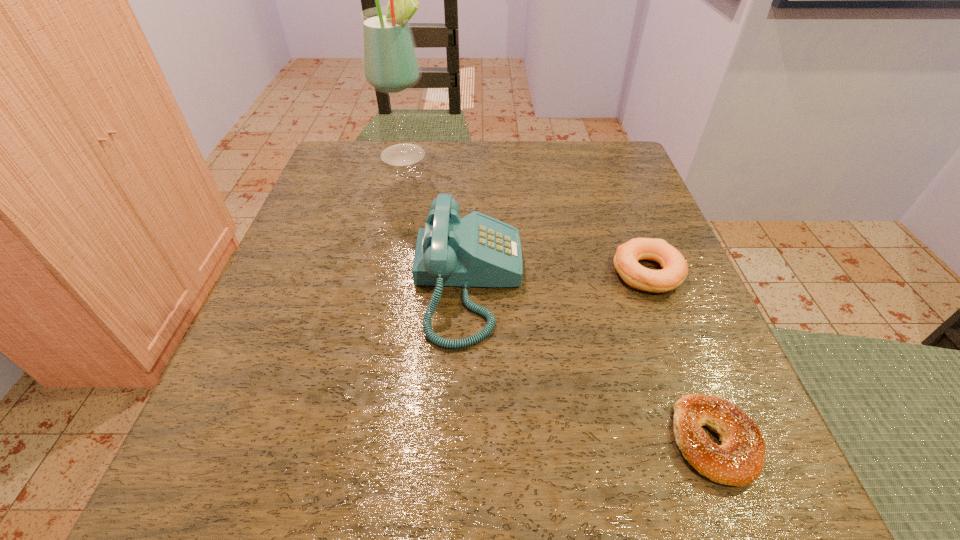
The image size is (960, 540). In order to click on free space at the near left corner of the desktop in this screenshot , I will do `click(292, 503)`.

In the image, there is a desktop. Where is `vacant space at the far right corner`? The image size is (960, 540). vacant space at the far right corner is located at coordinates (567, 141).

Locate an element on the screen. The width and height of the screenshot is (960, 540). free area in between the tallest object and the taller bagel is located at coordinates (526, 214).

The image size is (960, 540). I want to click on empty location between the farthest object and the shortest object, so click(560, 298).

Locate an element on the screen. The width and height of the screenshot is (960, 540). empty location between the nearest object and the third shortest object is located at coordinates (591, 362).

Image resolution: width=960 pixels, height=540 pixels. Find the location of `free space between the tallest object and the nearer bagel`. free space between the tallest object and the nearer bagel is located at coordinates pyautogui.click(x=560, y=298).

Where is `free space between the alcohol and the second shortest object`? free space between the alcohol and the second shortest object is located at coordinates (526, 214).

Image resolution: width=960 pixels, height=540 pixels. What are the coordinates of `free space between the shortest object and the second shortest object` in the screenshot? It's located at (681, 357).

Find the location of a particular element. This screenshot has height=540, width=960. free space between the telephone and the taller bagel is located at coordinates (558, 279).

Locate an element on the screen. free area in between the telephone and the nearer bagel is located at coordinates (591, 362).